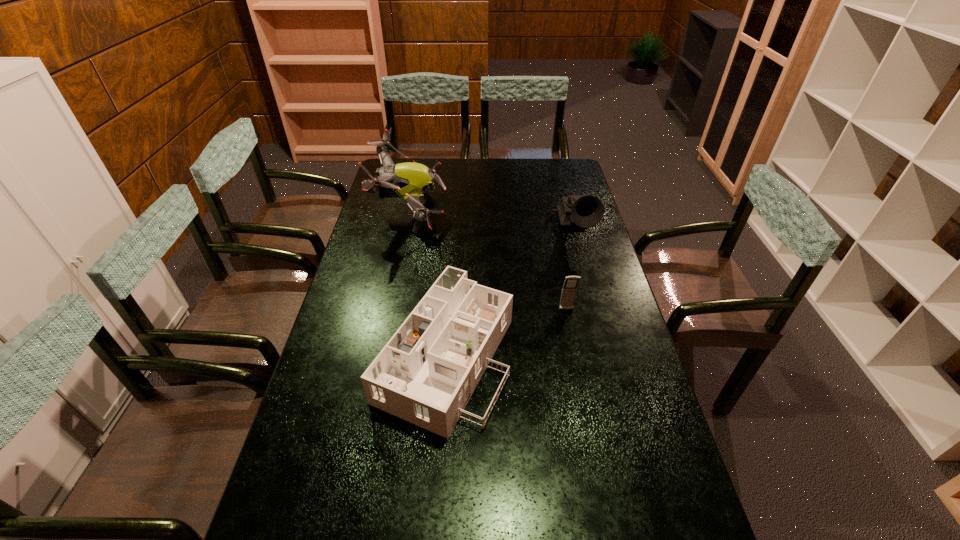
Locate an element on the screen. This screenshot has height=540, width=960. free space between the third shortest object and the tallest object is located at coordinates (492, 219).

At what (x,y) coordinates should I click in order to perform the action: click on vacant space that is in between the second shortest object and the shortest object. Please return your answer as a coordinate pair (x, y). The height and width of the screenshot is (540, 960). Looking at the image, I should click on (506, 332).

This screenshot has width=960, height=540. I want to click on free space that is in between the second shortest object and the second tallest object, so [571, 268].

Where is `vacant area that lies between the cellular telephone and the third shortest object`? The image size is (960, 540). vacant area that lies between the cellular telephone and the third shortest object is located at coordinates (571, 268).

You are a GUI agent. You are given a task and a screenshot of the screen. Output one action in this format:
    pyautogui.click(x=<x>, y=<y>)
    Task: Click on the free space between the shortest object and the drone
    
    Given the screenshot: What is the action you would take?
    pyautogui.click(x=428, y=282)

Where is `empty space between the tallest object and the phonograph_record`? Image resolution: width=960 pixels, height=540 pixels. empty space between the tallest object and the phonograph_record is located at coordinates (492, 219).

The width and height of the screenshot is (960, 540). I want to click on free space between the dollhouse and the second shortest object, so [506, 332].

Where is `the third closest object to the third tallest object`? The image size is (960, 540). the third closest object to the third tallest object is located at coordinates (409, 181).

Choose which object is the nearest neighbor to the drone. Please provide its 2D coordinates. Your answer should be formatted as a tuple, i.e. [(x, y)], where the tuple contains the x and y coordinates of a point satisfying the conditions above.

[(426, 373)]

Where is `vacant area that satisfies the following two spatial constraints: 1. on the front-facing side of the drone; 2. on the back side of the dollhouse`? vacant area that satisfies the following two spatial constraints: 1. on the front-facing side of the drone; 2. on the back side of the dollhouse is located at coordinates (379, 355).